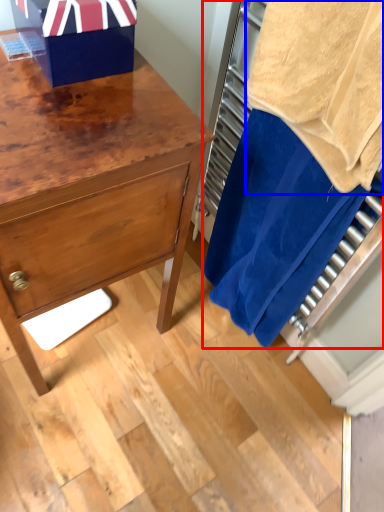
Question: Which object is further to the camera taking this photo, laundry (highlighted by a red box) or bath towel (highlighted by a blue box)?

Choices:
 (A) laundry
 (B) bath towel

Answer: (A)